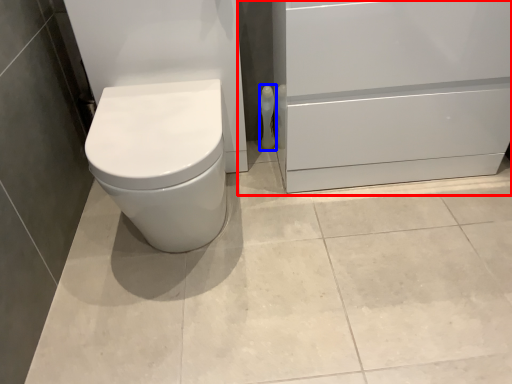
Question: Among these objects, which one is farthest to the camera, file cabinet (highlighted by a red box) or toilet paper (highlighted by a blue box)?

Choices:
 (A) file cabinet
 (B) toilet paper

Answer: (B)